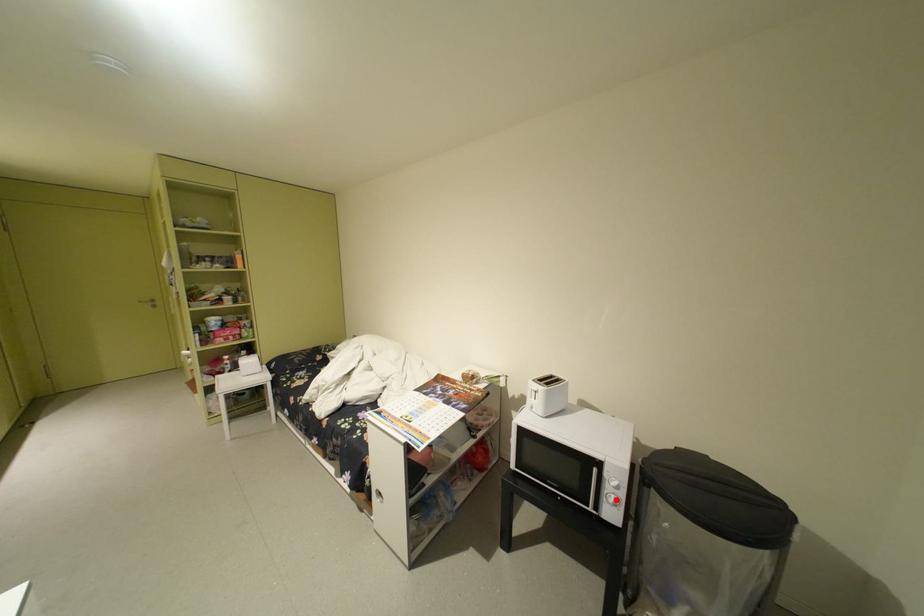
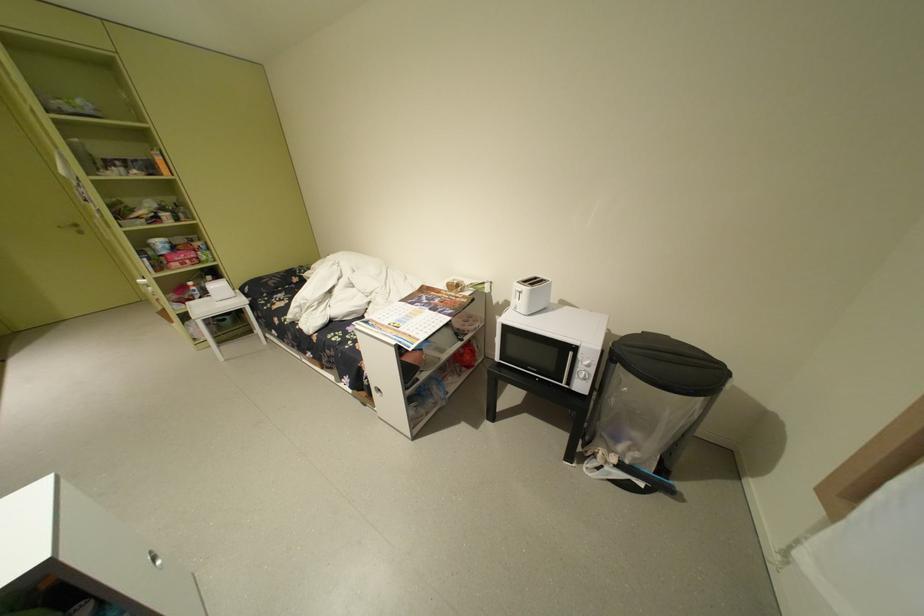
Where in the second image is the point corresponding to the highlighted location from the first image?

(588, 377)